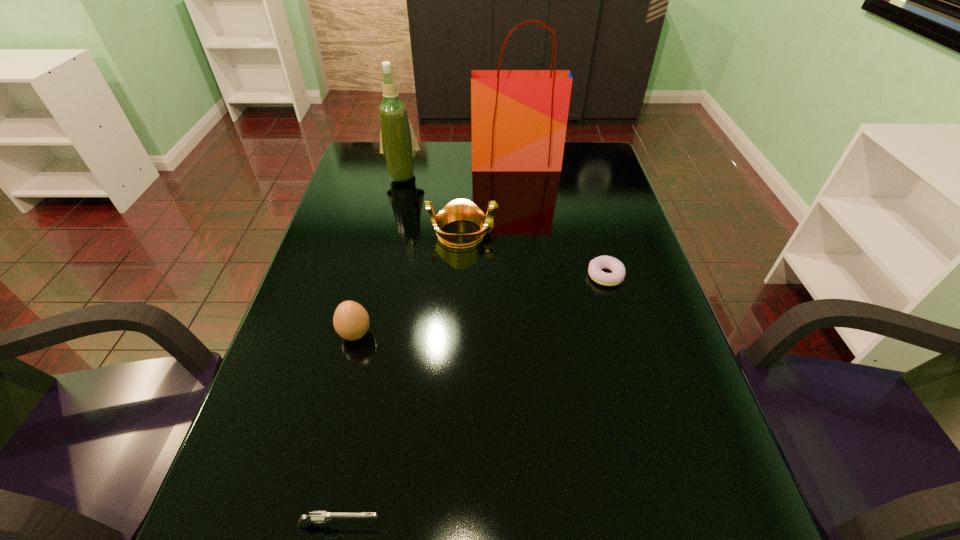
Locate an element on the screen. This screenshot has height=540, width=960. vacant space located at the front emblem of the third farthest object is located at coordinates (522, 233).

The image size is (960, 540). I want to click on vacant area located 0.180m on the right of the boiled egg, so click(452, 334).

You are a GUI agent. You are given a task and a screenshot of the screen. Output one action in this format:
    pyautogui.click(x=<x>, y=<y>)
    Task: Click on the vacant region located 0.270m on the front-facing side of the nearest object
    The image size is (960, 540).
    Given the screenshot: What is the action you would take?
    pyautogui.click(x=548, y=525)

The width and height of the screenshot is (960, 540). What are the coordinates of `free space located on the back of the doughnut` in the screenshot? It's located at (583, 197).

This screenshot has width=960, height=540. I want to click on shopping bag at the far edge, so click(x=519, y=118).

Find the location of `wine bottle that is at the far edge`. wine bottle that is at the far edge is located at coordinates (398, 143).

Image resolution: width=960 pixels, height=540 pixels. I want to click on wine bottle that is at the left edge, so click(398, 143).

Find the location of a particular element. The image size is (960, 540). boiled egg at the left edge is located at coordinates (351, 321).

You are a GUI agent. You are given a task and a screenshot of the screen. Output one action in this format:
    pyautogui.click(x=<x>, y=<y>)
    Task: Click on the pistol that is at the left edge
    This screenshot has width=960, height=540.
    Given the screenshot: What is the action you would take?
    pyautogui.click(x=317, y=516)

Identify the location of object that is at the right edge. Image resolution: width=960 pixels, height=540 pixels. (602, 262).